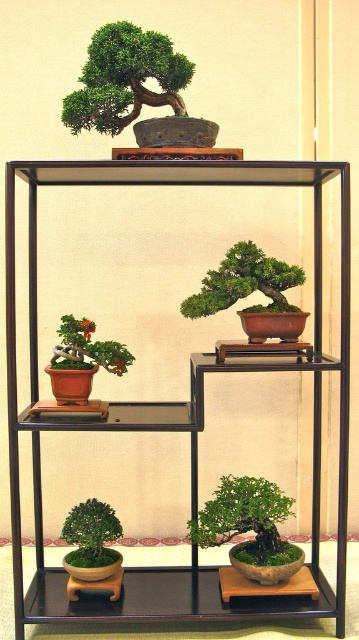
Is green matte bonsai tree at upper center closer to camera compared to matte brown bonsai at lower left?

Yes, it is in front of matte brown bonsai at lower left.

Who is positioned more to the right, green matte bonsai tree at upper center or matte brown bonsai at lower left?

green matte bonsai tree at upper center is more to the right.

What do you see at coordinates (124, 77) in the screenshot? The width and height of the screenshot is (359, 640). I see `green matte bonsai tree at upper center` at bounding box center [124, 77].

Locate an element on the screen. Image resolution: width=359 pixels, height=640 pixels. green matte bonsai tree at upper center is located at coordinates (124, 77).

Between point (148, 572) and point (238, 284), which one is positioned behind?

The point (148, 572) is more distant.

Can you confirm if transparent glass shelf at upper center is bigger than green matte bonsai tree at center?

Yes.

Locate an element on the screen. This screenshot has height=640, width=359. transparent glass shelf at upper center is located at coordinates (171, 403).

Based on the photo, is green matte bonsai tree at lower center below green matte bonsai tree at center?

Yes, green matte bonsai tree at lower center is below green matte bonsai tree at center.

Between green matte bonsai tree at lower center and green matte bonsai tree at center, which one is positioned lower?

green matte bonsai tree at lower center

Is point (262, 490) in front of point (288, 288)?

That is False.

The height and width of the screenshot is (640, 359). Find the location of `green matte bonsai tree at lower center`. green matte bonsai tree at lower center is located at coordinates click(x=244, y=518).